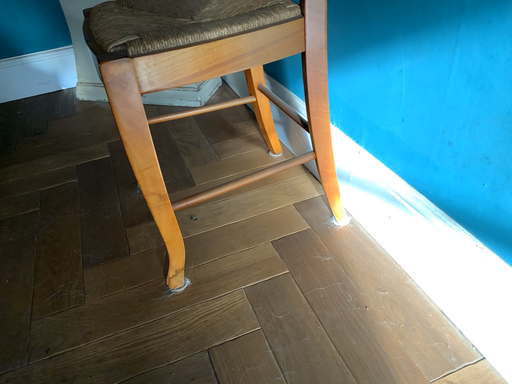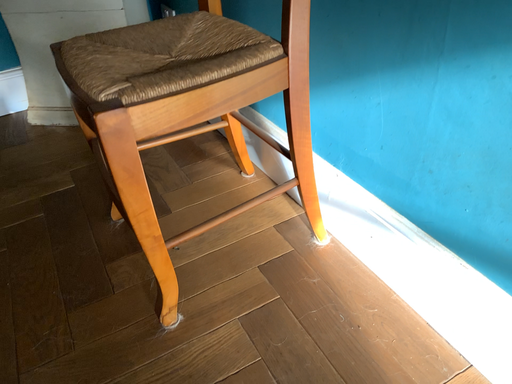
Question: How did the camera likely rotate when shooting the video?

Choices:
 (A) rotated right
 (B) rotated left

Answer: (A)